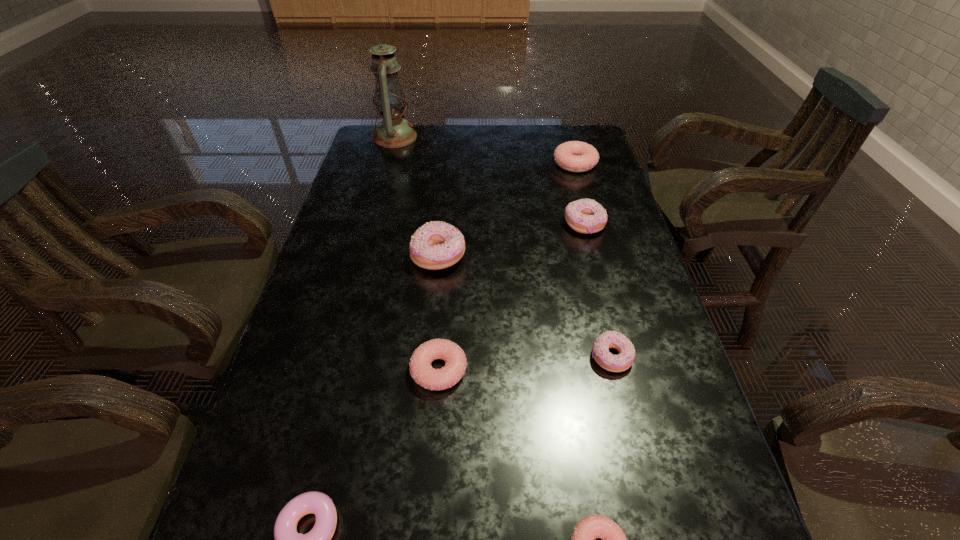
Image resolution: width=960 pixels, height=540 pixels. I want to click on vacant space located on the front of the oil lamp, so click(x=376, y=207).

I want to click on vacant space located on the front of the tallest doughnut, so click(x=434, y=300).

Where is `blank space located on the left of the third smallest purple doughnut`? blank space located on the left of the third smallest purple doughnut is located at coordinates (517, 225).

Locate an element on the screen. This screenshot has width=960, height=540. vacant space located 0.250m on the left of the rightmost pink doughnut is located at coordinates (479, 164).

You are a GUI agent. You are given a task and a screenshot of the screen. Output one action in this format:
    pyautogui.click(x=<x>, y=<y>)
    Task: Click on the vacant space located 0.130m on the front of the second nearest purple doughnut
    
    Given the screenshot: What is the action you would take?
    pyautogui.click(x=630, y=436)

Where is `vacant space located on the right of the second farthest pink doughnut`? vacant space located on the right of the second farthest pink doughnut is located at coordinates (548, 370).

At what (x,y) coordinates should I click in order to perform the action: click on oil lamp located at the far edge. Please return your answer as a coordinate pair (x, y). Looking at the image, I should click on (390, 100).

Locate an element on the screen. The width and height of the screenshot is (960, 540). doughnut that is at the far edge is located at coordinates (574, 156).

You are a GUI agent. You are given a task and a screenshot of the screen. Output one action in this format:
    pyautogui.click(x=<x>, y=<y>)
    Task: Click on the object that is at the left edge
    
    Given the screenshot: What is the action you would take?
    pyautogui.click(x=390, y=100)

Locate an element on the screen. The height and width of the screenshot is (540, 960). object present at the far left corner is located at coordinates (390, 100).